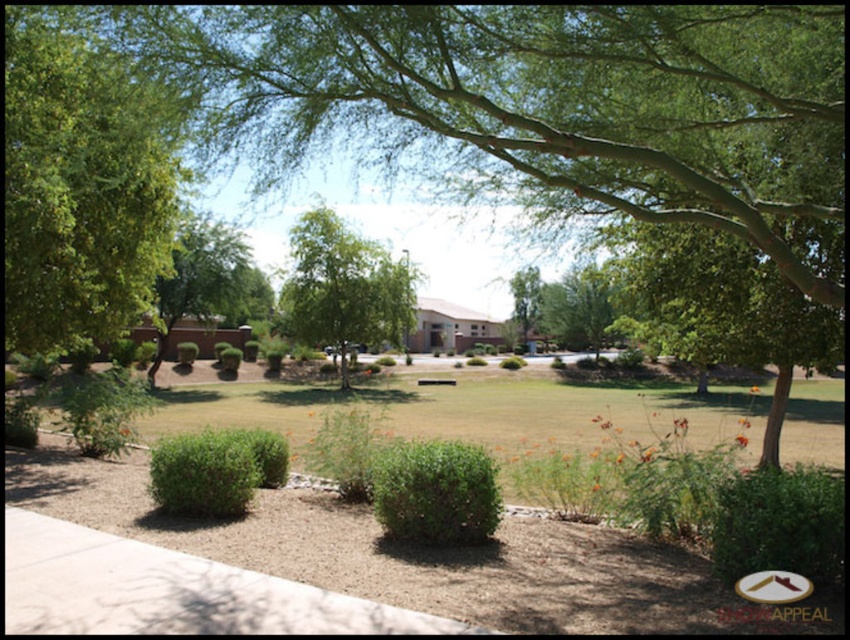
Does point (103, 189) come closer to viewer compared to point (347, 381)?

Yes, point (103, 189) is closer to viewer.

Does point (136, 221) come closer to viewer compared to point (411, 312)?

Yes.

Find the location of a particular element. This screenshot has height=640, width=850. green leafy tree at left is located at coordinates (81, 182).

Which is more to the left, green leafy tree at center or green leafy hedge at lower right?

green leafy tree at center is more to the left.

Is green leafy tree at center above green leafy hedge at lower right?

Indeed, green leafy tree at center is positioned over green leafy hedge at lower right.

Is point (293, 228) behind point (797, 532)?

Yes, point (293, 228) is farther from viewer.

Identify the location of green leafy tree at center. This screenshot has width=850, height=640. (343, 288).

Between point (748, 534) and point (191, 449), which one is positioned in front?

Positioned in front is point (748, 534).

Describe the element at coordinates (780, 522) in the screenshot. I see `green leafy hedge at lower right` at that location.

In order to click on green leafy hedge at lower right in this screenshot , I will do `click(780, 522)`.